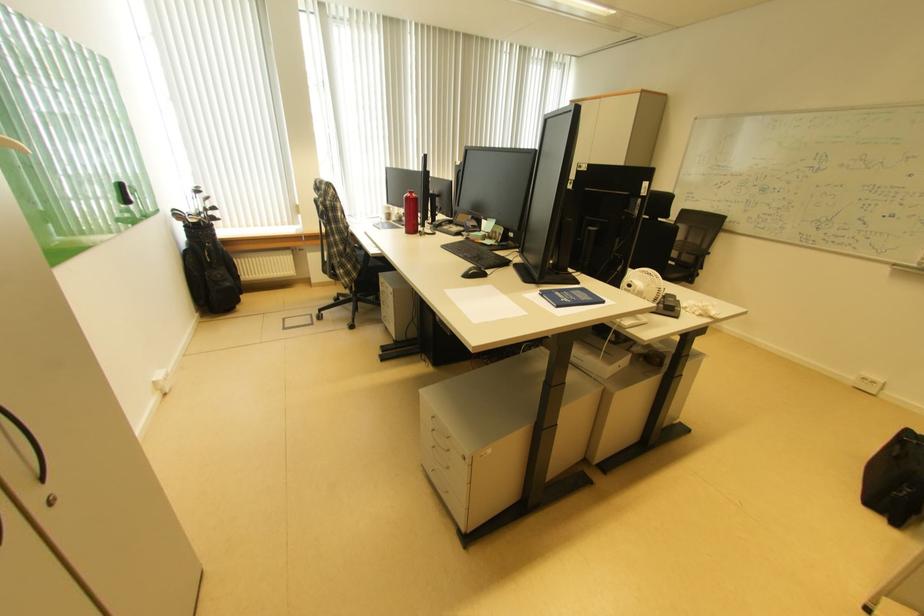
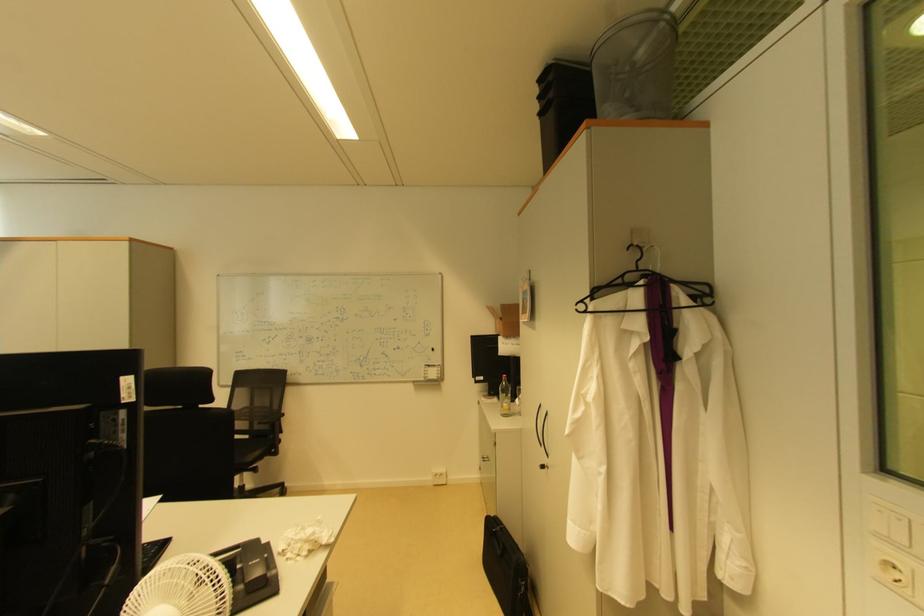
Find the pixel in the second image that matches (673,306) in the first image.

(254, 586)